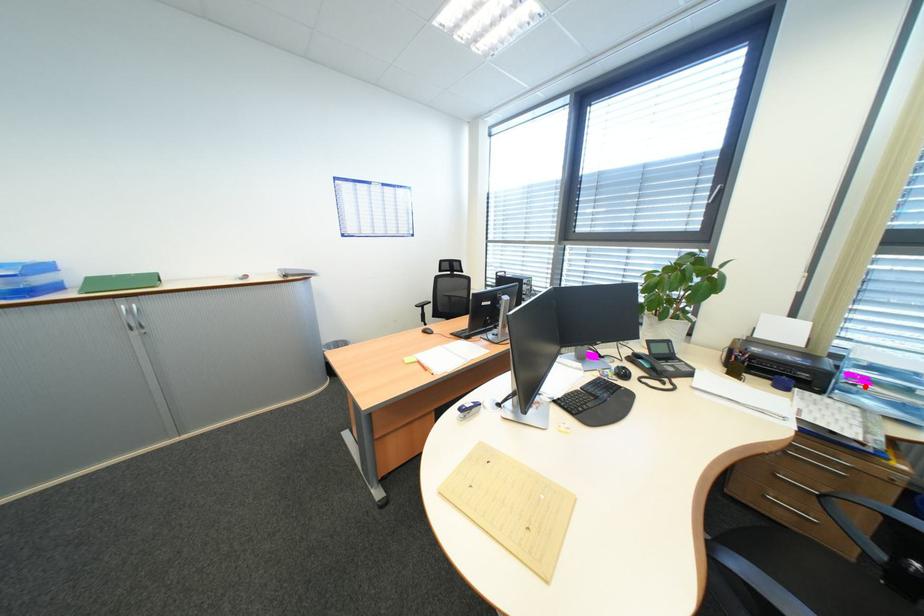
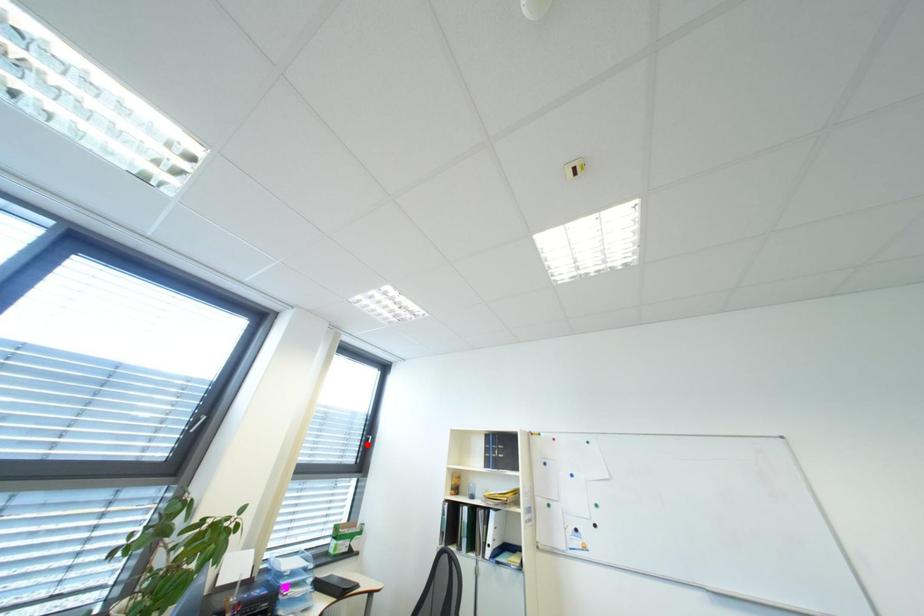
I am providing you with two images of the same scene from different viewpoints. A red point is marked on the first image and another point is marked on the second image. Are the points marked in image1 and image2 representing the same 3D position?

No